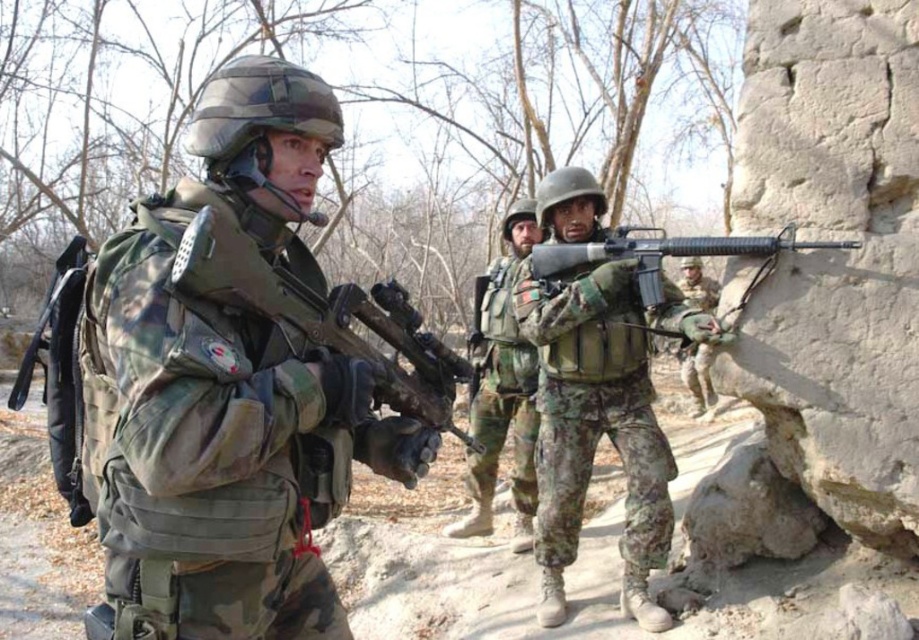
You are a drone operator observing the tactical operation. You need to determine which of the two points, point [139,476] or point [532,273], is closer to the camera. Based on the coordinates provided, which one is nearer?

Point [139,476] is closer to the camera than point [532,273].

You are a soldier in the group and need to reach a point marked at coordinates point (x=138, y=419). Your current position is 1.83 meters away from this point. Can you safely move to this point without needing to cross any obstacles?

The point (x=138, y=419) is 1.83 meters away from you, so you can safely move to this point without needing to cross any obstacles as there are no obstacles mentioned in the scene description.

You are a soldier in the group and need to quickly grab a rifle. Which rifle is closer to you, the camouflage fabric rifle at center or the matte black rifle at center?

The camouflage fabric rifle at center is closer to you because it is positioned further to the viewer than the matte black rifle at center.